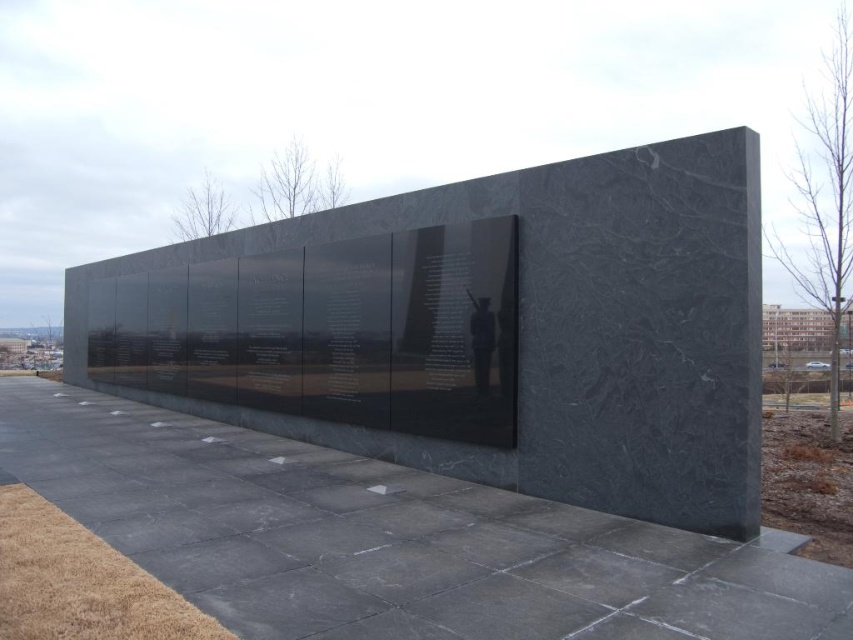
Question: Is black polished stone wall at center wider than black polished concrete at center?

Choices:
 (A) yes
 (B) no

Answer: (A)

Question: Does black polished stone wall at center have a greater width compared to matte black statue at center?

Choices:
 (A) no
 (B) yes

Answer: (B)

Question: Is black polished concrete at center positioned at the back of matte black statue at center?

Choices:
 (A) no
 (B) yes

Answer: (A)

Question: Estimate the real-world distances between objects in this image. Which object is farther from the black polished stone wall at center?

Choices:
 (A) matte black statue at center
 (B) black polished concrete at center

Answer: (B)

Question: Which object appears closest to the camera in this image?

Choices:
 (A) black polished concrete at center
 (B) black polished stone wall at center

Answer: (A)

Question: Which object is the closest to the black polished concrete at center?

Choices:
 (A) matte black statue at center
 (B) black polished stone wall at center

Answer: (B)